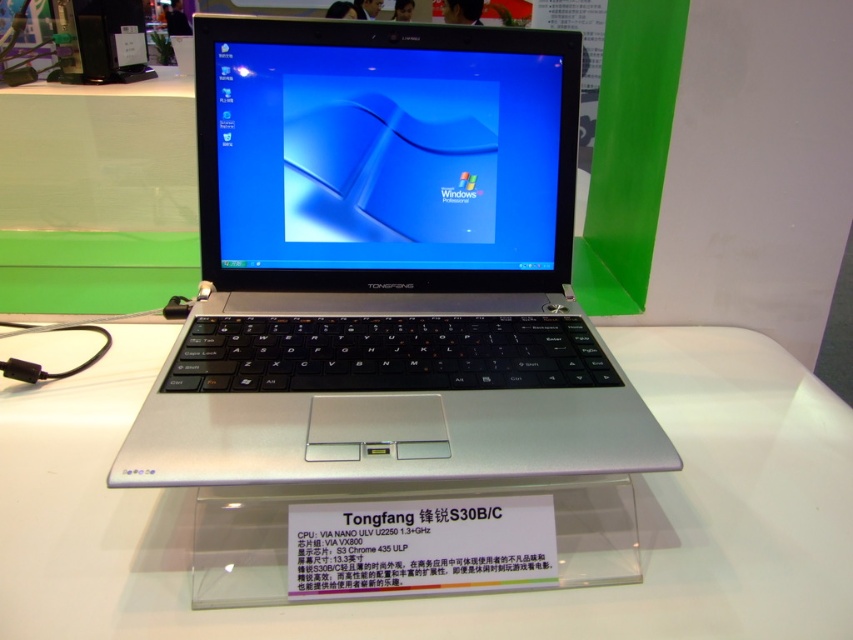
You are setting up a display at a tech exhibition. You have a silver metallic laptop at center and a silver metallic table at center. The laptop needs to be placed on the table. Will the laptop fit entirely on the table without overhanging the edges?

The silver metallic laptop at center has a width less than the silver metallic table at center, so the laptop will fit entirely on the table without overhanging the edges.

You are at a tech exhibition and see the silver metallic table at center and the transparent glass display at center. Which object is placed on top of the other?

The silver metallic table at center is positioned over transparent glass display at center.

You are setting up a display at a tech exhibition and need to place both the silver metallic laptop at center and the transparent glass display at center on a shelf. The shelf has limited space, and you want to ensure that the larger item is placed first to avoid overcrowding. Which item should you place first?

The silver metallic laptop at center is larger in size than the transparent glass display at center, so you should place the silver metallic laptop at center first to accommodate its size and prevent overcrowding.